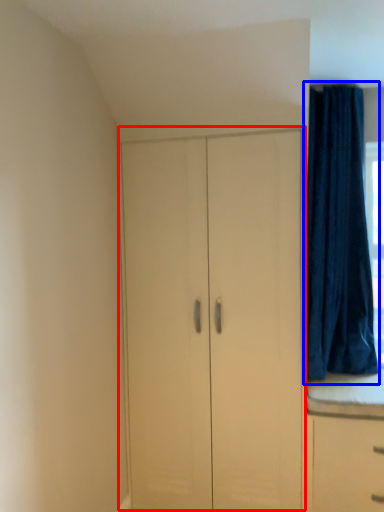
Question: Which of the following is the farthest to the observer, cupboard (highlighted by a red box) or curtain (highlighted by a blue box)?

Choices:
 (A) cupboard
 (B) curtain

Answer: (B)